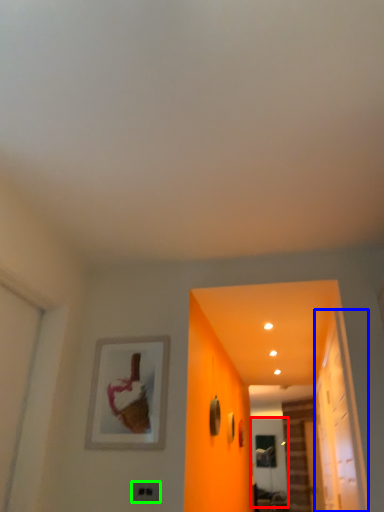
Question: Which object is the farthest from screen door (highlighted by a red box)? Choose among these: glass door (highlighted by a blue box) or electric outlet (highlighted by a green box).

Choices:
 (A) glass door
 (B) electric outlet

Answer: (B)